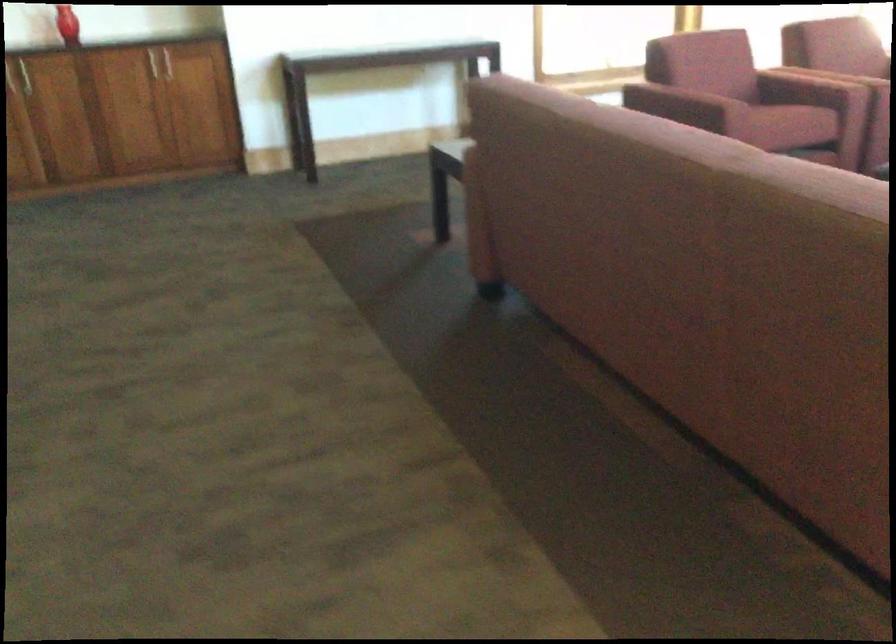
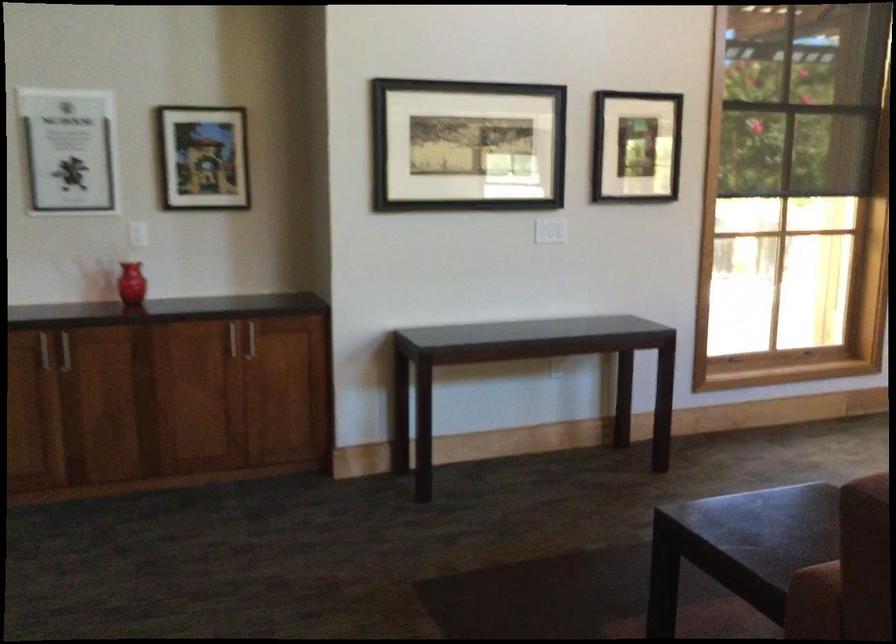
Which direction would the cameraman need to move to produce the second image?

The cameraman walked toward left, forward.